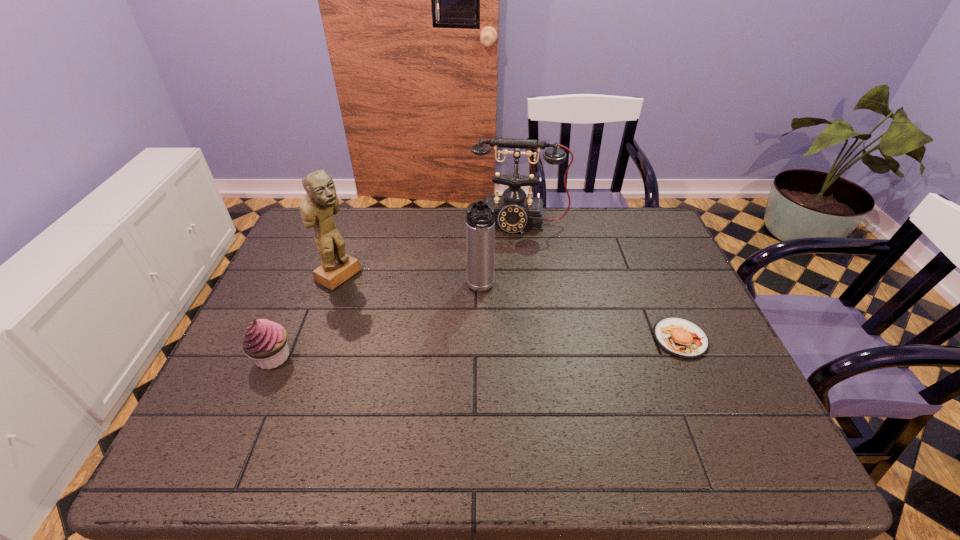
Where is `free location located 0.100m on the dial of the farthest object`? free location located 0.100m on the dial of the farthest object is located at coordinates (514, 255).

Where is `free location located on the front-facing side of the figurine`? This screenshot has width=960, height=540. free location located on the front-facing side of the figurine is located at coordinates (400, 308).

At what (x,y) coordinates should I click in order to perform the action: click on vacant space located on the front-facing side of the figurine. Please return your answer as a coordinate pair (x, y). Looking at the image, I should click on (378, 296).

At what (x,y) coordinates should I click in order to perform the action: click on blank space located on the front-facing side of the figurine. Please return your answer as a coordinate pair (x, y). Looking at the image, I should click on (378, 296).

Image resolution: width=960 pixels, height=540 pixels. I want to click on vacant space located 0.300m on the handle side of the thermos bottle, so click(489, 401).

This screenshot has height=540, width=960. Find the location of `vacant space located on the handle side of the thermos bottle`. vacant space located on the handle side of the thermos bottle is located at coordinates (485, 354).

Locate an element on the screen. The width and height of the screenshot is (960, 540). vacant space positioned 0.300m on the handle side of the thermos bottle is located at coordinates (489, 401).

I want to click on object at the far edge, so click(514, 212).

I want to click on cupcake located in the left edge section of the desktop, so click(265, 341).

The height and width of the screenshot is (540, 960). What are the coordinates of `figurine at the left edge` in the screenshot? It's located at (318, 206).